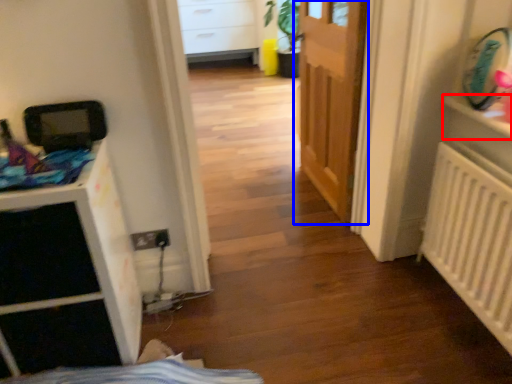
Question: Among these objects, which one is farthest to the camera, shelf (highlighted by a red box) or door (highlighted by a blue box)?

Choices:
 (A) shelf
 (B) door

Answer: (B)